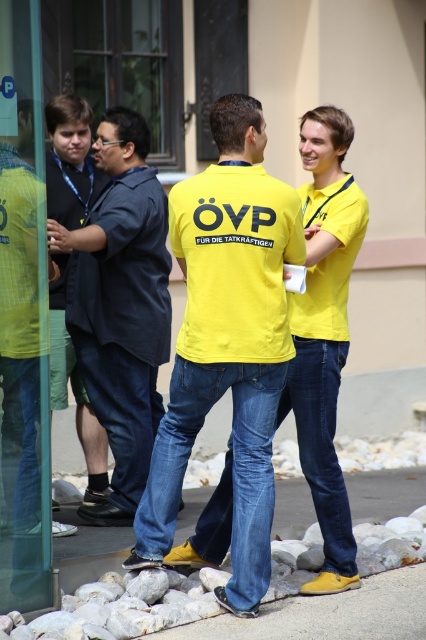
You are a photographer standing at a certain distance from the yellow matte shirt at center. You want to take a photo of the shirt clearly. The ideal distance for your camera to focus is between 15 to 20 feet. Is the current distance suitable for a clear photo?

The yellow matte shirt at center is 17.59 feet away from the camera, which falls within the ideal focus distance range of 15 to 20 feet. Therefore, the current distance is suitable for capturing a clear photo.

You are a photographer trying to capture a photo of the yellow matte shirt at center and the transparent glass door at left. Based on their sizes, which object should you focus on first to ensure they both fit in the frame?

The yellow matte shirt at center is larger than the transparent glass door at left, so you should focus on the yellow matte shirt at center first to ensure both fit in the frame.

You are a photographer at the event and need to ensure both the yellow matte shirt at center and the dark blue shirt at left are visible in the frame. Given their sizes, which shirt should you focus on to ensure both are in the shot without cropping?

The yellow matte shirt at center is smaller in size compared to the dark blue shirt at left. To ensure both are visible, focus on framing the shot so the larger dark blue shirt at left is fully included, as the smaller yellow matte shirt at center can be accommodated within the same frame.